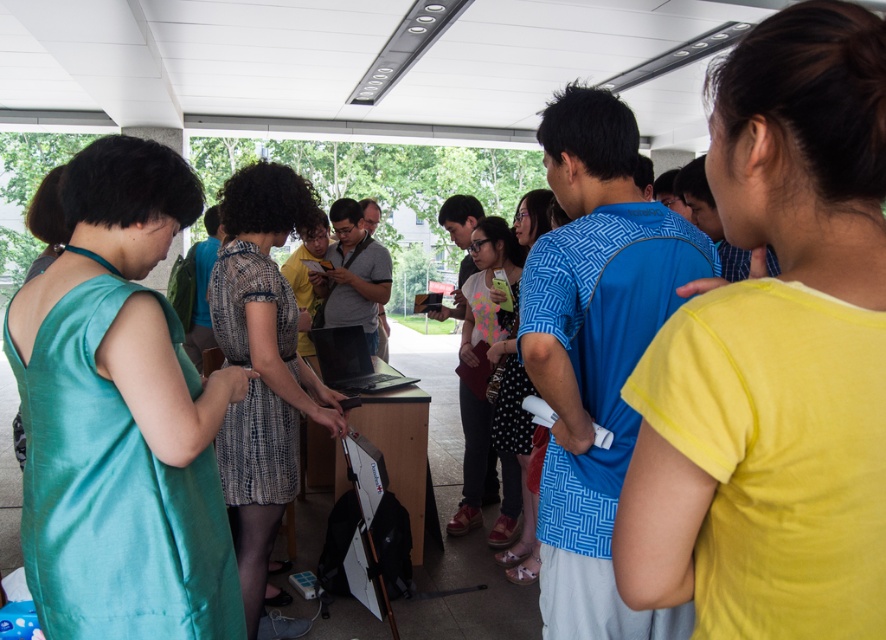
You are at an event and see two dresses, the teal silk dress at left and the polka dot dress at center. Which dress is located to the left of the other?

The teal silk dress at left is positioned on the left side of the polka dot dress at center.

You are at an event and want to find the polka dot dress at center and the patterned fabric dress at center. Which one is positioned to the left?

The polka dot dress at center is positioned to the left of the patterned fabric dress at center.

You are at an event and see two people wearing a yellow matte shirt at center and a plaid fabric dress at center. Which one is positioned more to the left?

The plaid fabric dress at center is more to the left since the yellow matte shirt at center is to its right.